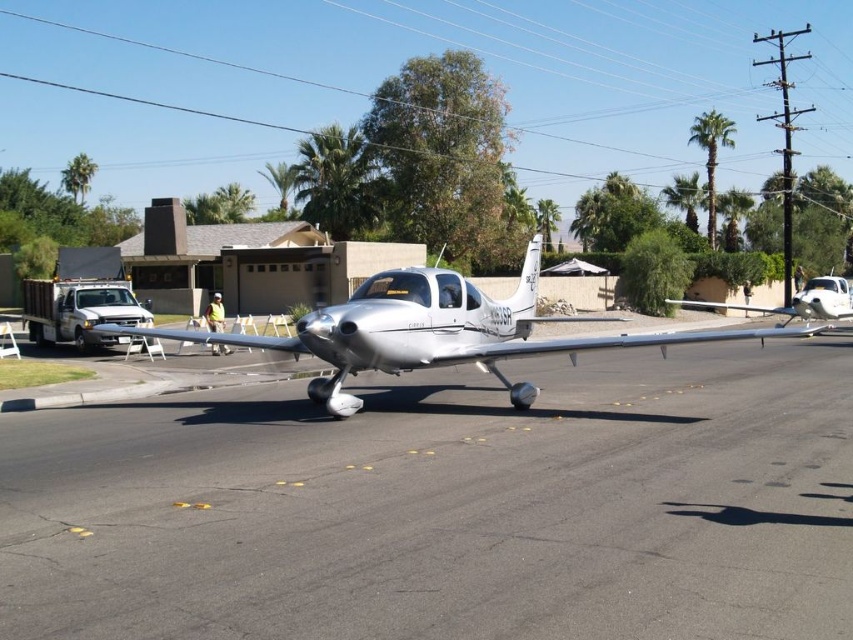
Question: Can you confirm if smooth asphalt tarmac at center is wider than silver metallic airplane at right?

Choices:
 (A) yes
 (B) no

Answer: (A)

Question: Based on their relative distances, which object is farther from the silver metallic airplane at center?

Choices:
 (A) smooth asphalt tarmac at center
 (B) silver metallic airplane at right

Answer: (B)

Question: Which point is closer to the camera?

Choices:
 (A) silver metallic airplane at center
 (B) silver metallic airplane at right

Answer: (A)

Question: Does silver metallic airplane at center have a greater width compared to silver metallic airplane at right?

Choices:
 (A) yes
 (B) no

Answer: (A)

Question: Among these points, which one is farthest from the camera?

Choices:
 (A) (183, 333)
 (B) (749, 401)
 (C) (821, 284)

Answer: (C)

Question: Does smooth asphalt tarmac at center have a smaller size compared to silver metallic airplane at center?

Choices:
 (A) no
 (B) yes

Answer: (B)